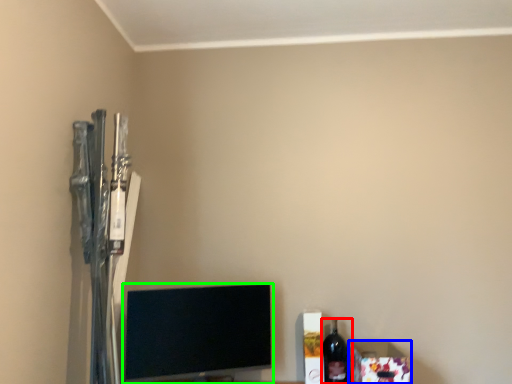
Question: Based on their relative distances, which object is nearer to bottle (highlighted by a red box)? Choose from box (highlighted by a blue box) and television (highlighted by a green box).

Choices:
 (A) box
 (B) television

Answer: (A)